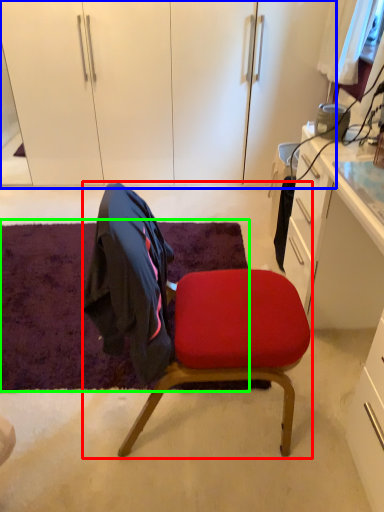
Question: Which object is positioned closest to chair (highlighted by a red box)? Select from dresser (highlighted by a blue box) and mat (highlighted by a green box).

Choices:
 (A) dresser
 (B) mat

Answer: (B)